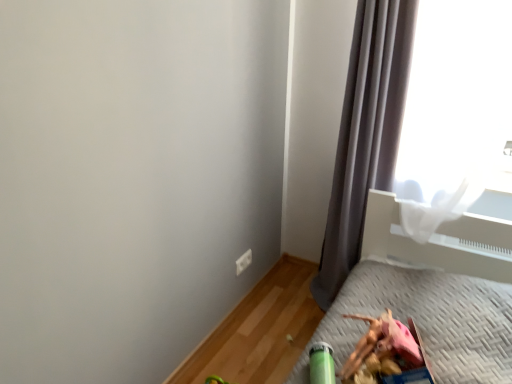
Measure the distance between point (388, 88) and camera.

Point (388, 88) and camera are 5.86 feet apart from each other.

The height and width of the screenshot is (384, 512). Describe the element at coordinates (365, 133) in the screenshot. I see `gray fabric curtain at upper right` at that location.

Identify the location of gray fabric curtain at upper right. Image resolution: width=512 pixels, height=384 pixels. (365, 133).

At what (x,y) coordinates should I click in order to perform the action: click on gray fabric curtain at upper right. Please return your answer as a coordinate pair (x, y). Looking at the image, I should click on (365, 133).